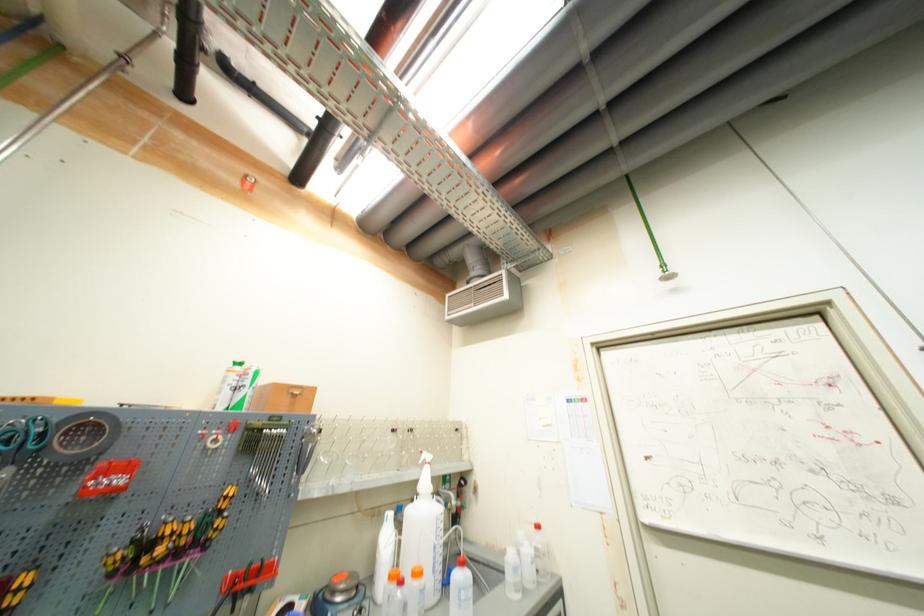
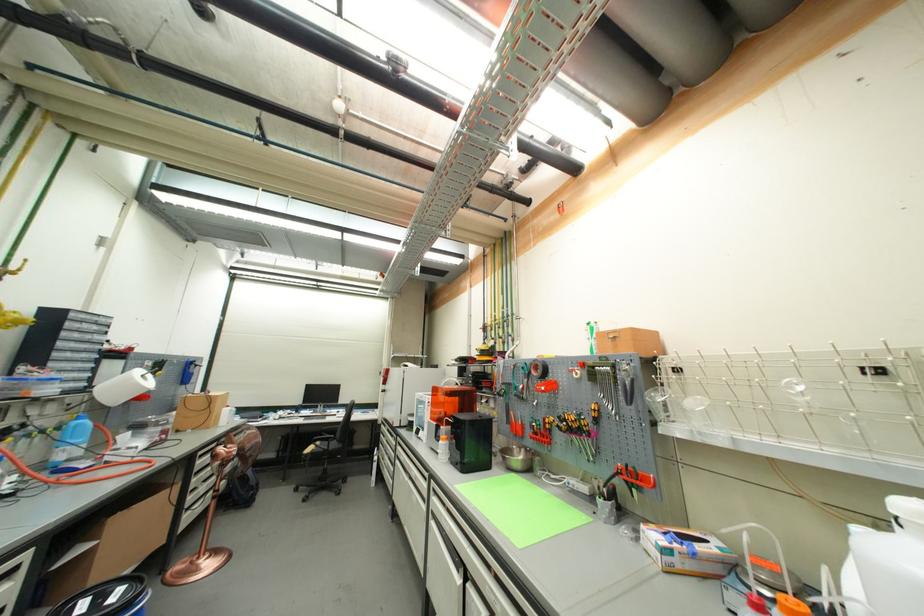
In the second image, find the point that corresponds to (x=229, y=509) in the first image.

(602, 418)